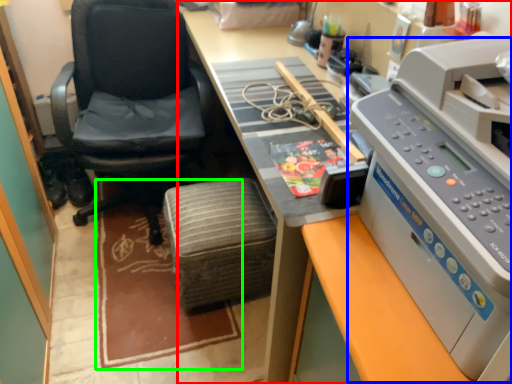
Question: Considering the real-world distances, which object is closest to desk (highlighted by a red box)? printer (highlighted by a blue box) or mat (highlighted by a green box).

Choices:
 (A) printer
 (B) mat

Answer: (A)